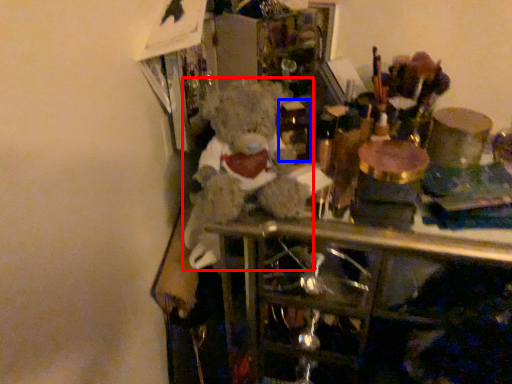
Question: Which object is further to the camera taking this photo, teddy bear (highlighted by a red box) or wine bottle (highlighted by a blue box)?

Choices:
 (A) teddy bear
 (B) wine bottle

Answer: (B)